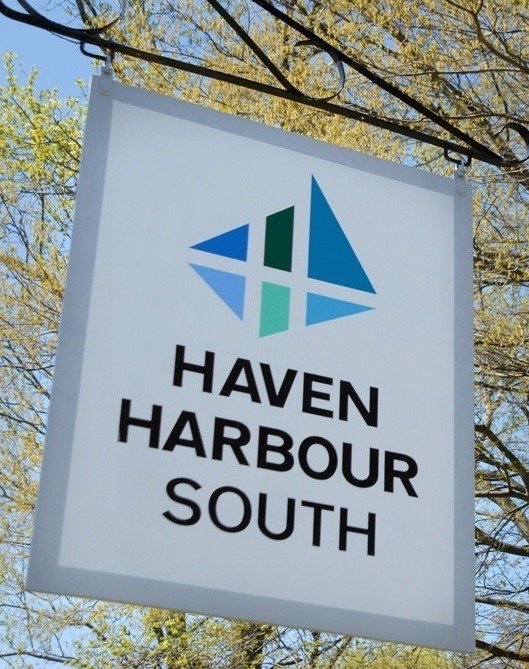
Locate an element on the screen. This screenshot has width=529, height=669. frame is located at coordinates (179, 66).